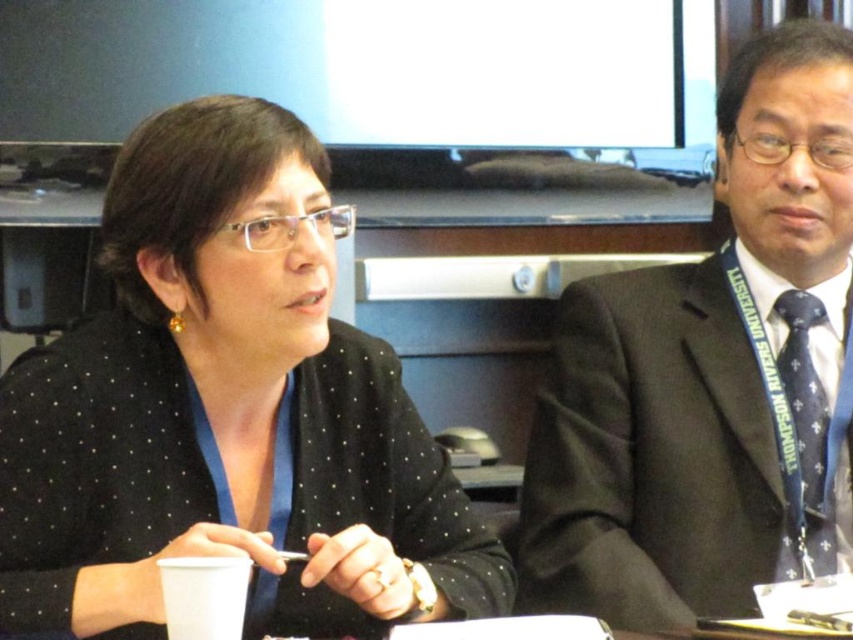
Does black dotted blazer at upper left appear on the right side of black suit at center?

No, black dotted blazer at upper left is not to the right of black suit at center.

Consider the image. Between black dotted blazer at upper left and black suit at center, which one has less height?

Standing shorter between the two is black dotted blazer at upper left.

Measure the distance between black dotted blazer at upper left and camera.

black dotted blazer at upper left and camera are 37.59 inches apart.

This screenshot has width=853, height=640. Identify the location of black dotted blazer at upper left. (225, 412).

In the scene shown: Is black suit at center below dark blue textured tie at right?

No.

Which is behind, point (842, 60) or point (817, 300)?

Positioned behind is point (817, 300).

The image size is (853, 640). What are the coordinates of `black suit at center` in the screenshot? It's located at point(711,376).

Between black dotted blazer at upper left and dark blue textured tie at right, which one appears on the left side from the viewer's perspective?

black dotted blazer at upper left

Looking at this image, is black dotted blazer at upper left below dark blue textured tie at right?

No.

Between point (352, 451) and point (819, 458), which one is positioned behind?

The point (819, 458) is behind.

Where is `black dotted blazer at upper left`? This screenshot has width=853, height=640. black dotted blazer at upper left is located at coordinates (225, 412).